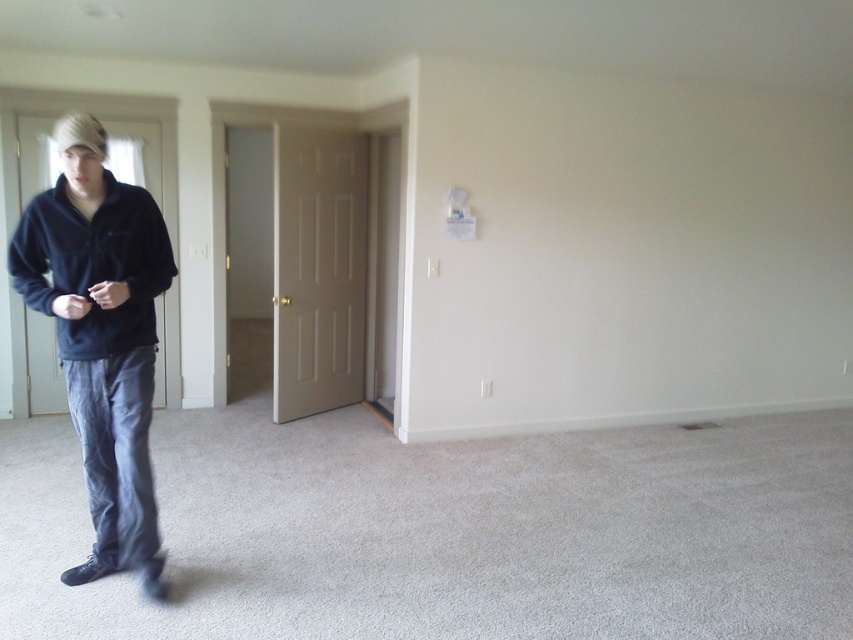
Question: From the image, what is the correct spatial relationship of dark blue fleece jacket at left in relation to matte black sweatshirt at left?

Choices:
 (A) right
 (B) left

Answer: (B)

Question: Which point is farther to the camera?

Choices:
 (A) (149, 516)
 (B) (51, 204)

Answer: (A)

Question: Does dark blue fleece jacket at left come behind matte black sweatshirt at left?

Choices:
 (A) yes
 (B) no

Answer: (B)

Question: Is dark blue fleece jacket at left closer to the viewer compared to matte black sweatshirt at left?

Choices:
 (A) no
 (B) yes

Answer: (B)